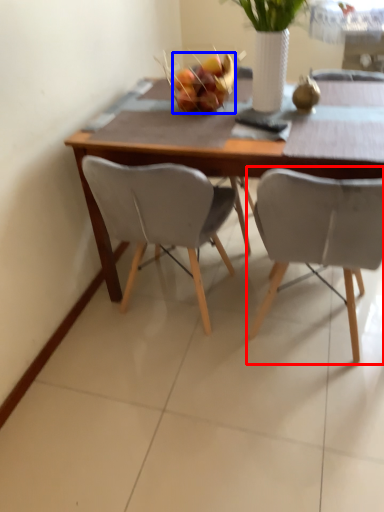
Question: Among these objects, which one is nearest to the camera, chair (highlighted by a red box) or fruit (highlighted by a blue box)?

Choices:
 (A) chair
 (B) fruit

Answer: (A)